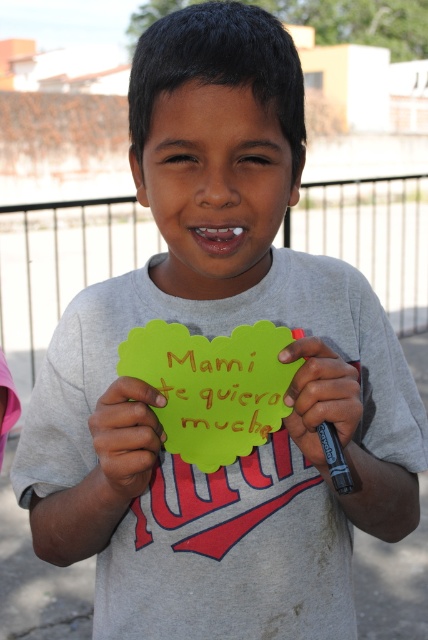
Does yellow paper at center appear on the left side of smooth yellow paper at center?

No, yellow paper at center is not to the left of smooth yellow paper at center.

Can you confirm if yellow paper at center is bigger than smooth yellow paper at center?

No.

In the scene shown: Who is more forward, (278, 364) or (148, 458)?

Point (148, 458) is in front.

The image size is (428, 640). What are the coordinates of `yellow paper at center` in the screenshot? It's located at (219, 392).

Is smooth yellow paper at center to the left of matte green paper at center from the viewer's perspective?

Correct, you'll find smooth yellow paper at center to the left of matte green paper at center.

Is smooth yellow paper at center smaller than matte green paper at center?

Actually, smooth yellow paper at center might be larger than matte green paper at center.

Who is more forward, (133, 467) or (347, 413)?

Point (133, 467) is more forward.

Locate an element on the screen. smooth yellow paper at center is located at coordinates (124, 442).

Which of these two, yellow paper at center or matte green paper at center, stands shorter?

yellow paper at center is shorter.

Locate an element on the screen. yellow paper at center is located at coordinates (219, 392).

Does point (211, 408) come in front of point (303, 445)?

No.

The width and height of the screenshot is (428, 640). What are the coordinates of `yellow paper at center` in the screenshot? It's located at (219, 392).